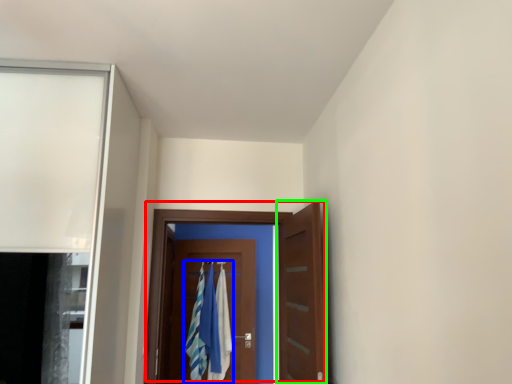
Question: Which is nearer to the door (highlighted by a red box)? laundry (highlighted by a blue box) or door (highlighted by a green box).

Choices:
 (A) laundry
 (B) door

Answer: (B)